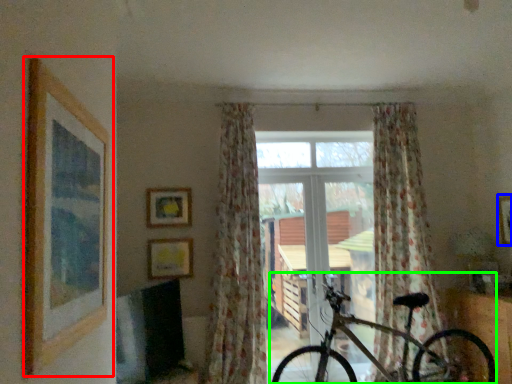
Question: Based on their relative distances, which object is nearer to picture frame (highlighted by a red box)? Choose from picture frame (highlighted by a blue box) and bicycle (highlighted by a green box).

Choices:
 (A) picture frame
 (B) bicycle

Answer: (B)